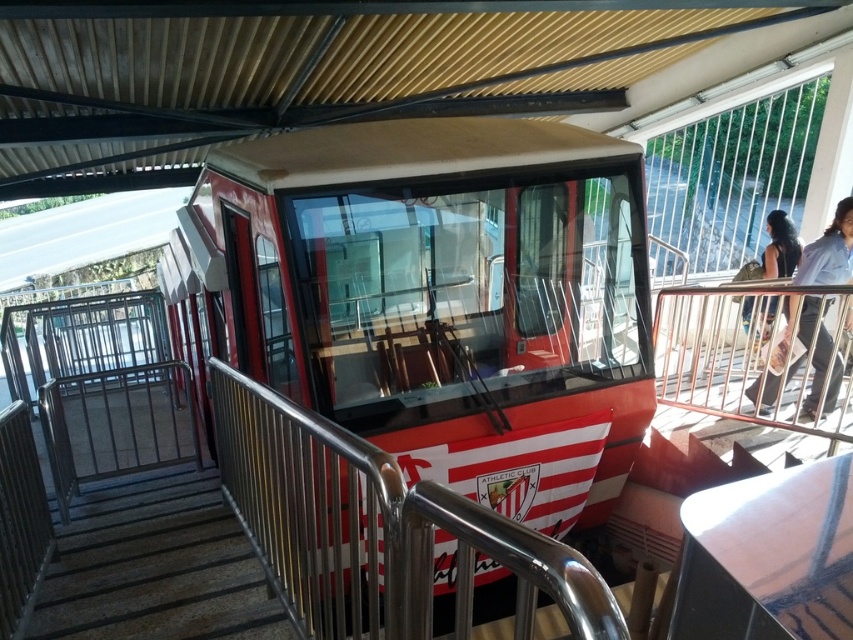
Is metallic gray stairs at lower left below dark hair at upper right?

Correct, metallic gray stairs at lower left is located below dark hair at upper right.

Who is lower down, metallic gray stairs at lower left or dark hair at upper right?

metallic gray stairs at lower left

Does point (148, 620) lie in front of point (825, 342)?

Yes.

The image size is (853, 640). In order to click on metallic gray stairs at lower left in this screenshot , I will do `click(155, 566)`.

Consider the image. Who is positioned more to the right, dark hair at upper right or dark brown hair at upper right?

dark brown hair at upper right

Who is higher up, dark hair at upper right or dark brown hair at upper right?

dark brown hair at upper right is higher up.

The image size is (853, 640). What are the coordinates of `dark hair at upper right` in the screenshot? It's located at (828, 252).

The image size is (853, 640). Identify the location of dark hair at upper right. coord(828,252).

Based on the photo, which of these two, red glossy train at center or metallic gray stairs at lower left, stands taller?

Standing taller between the two is red glossy train at center.

Does point (317, 148) come farther from viewer compared to point (67, 584)?

Yes, point (317, 148) is farther from viewer.

Find the location of `red glossy train at center`. red glossy train at center is located at coordinates (440, 298).